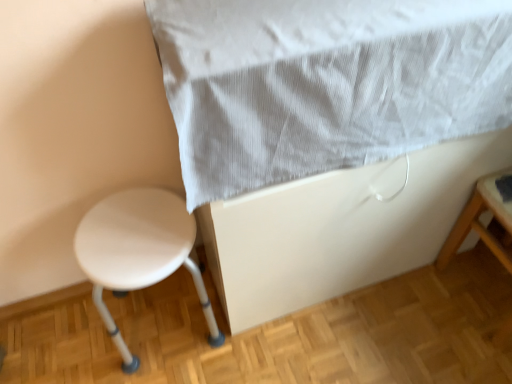
You are a GUI agent. You are given a task and a screenshot of the screen. Output one action in this format:
    pyautogui.click(x=<x>, y=<y>)
    Task: Click on the free space below white plastic stool at lower left (from a real-world perspective)
    Image resolution: width=512 pixels, height=384 pixels.
    Given the screenshot: What is the action you would take?
    click(x=162, y=319)